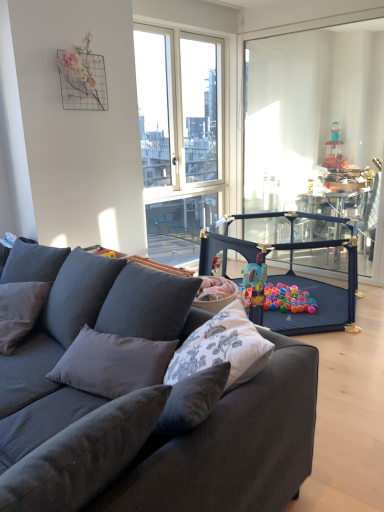
Question: From a real-world perspective, is dark gray fabric couch at center over dark gray fabric playpen at center?

Choices:
 (A) yes
 (B) no

Answer: (A)

Question: Is dark gray fabric couch at center shorter than dark gray fabric playpen at center?

Choices:
 (A) yes
 (B) no

Answer: (B)

Question: Is dark gray fabric couch at center looking in the opposite direction of dark gray fabric playpen at center?

Choices:
 (A) yes
 (B) no

Answer: (A)

Question: Considering the relative sizes of dark gray fabric couch at center and dark gray fabric playpen at center in the image provided, is dark gray fabric couch at center smaller than dark gray fabric playpen at center?

Choices:
 (A) no
 (B) yes

Answer: (A)

Question: Is dark gray fabric couch at center outside dark gray fabric playpen at center?

Choices:
 (A) yes
 (B) no

Answer: (A)

Question: Is dark gray fabric couch at center far from dark gray fabric playpen at center?

Choices:
 (A) yes
 (B) no

Answer: (A)

Question: Does dark gray fabric playpen at center lie behind dark gray fabric pillow at left?

Choices:
 (A) no
 (B) yes

Answer: (B)

Question: Is dark gray fabric playpen at center not inside dark gray fabric pillow at left?

Choices:
 (A) no
 (B) yes

Answer: (B)

Question: Considering the relative positions of dark gray fabric playpen at center and dark gray fabric pillow at left in the image provided, is dark gray fabric playpen at center in front of dark gray fabric pillow at left?

Choices:
 (A) no
 (B) yes

Answer: (A)

Question: Is dark gray fabric playpen at center to the left of dark gray fabric pillow at left from the viewer's perspective?

Choices:
 (A) no
 (B) yes

Answer: (A)

Question: Are dark gray fabric playpen at center and dark gray fabric pillow at left located far from each other?

Choices:
 (A) no
 (B) yes

Answer: (B)

Question: Is dark gray fabric pillow at left a part of dark gray fabric playpen at center?

Choices:
 (A) no
 (B) yes

Answer: (A)

Question: Can we say dark gray fabric pillow at left lies outside transparent plastic playpen at right?

Choices:
 (A) yes
 (B) no

Answer: (A)